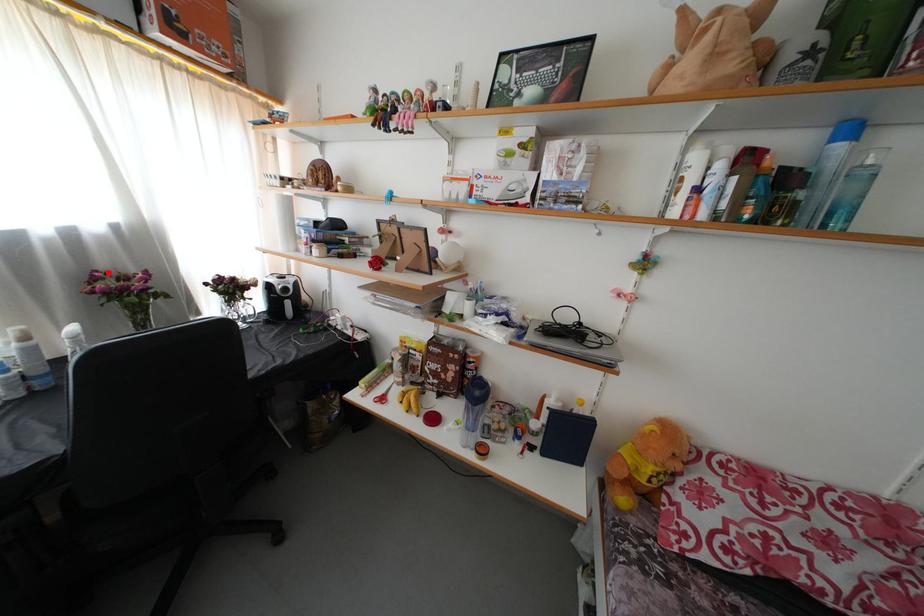
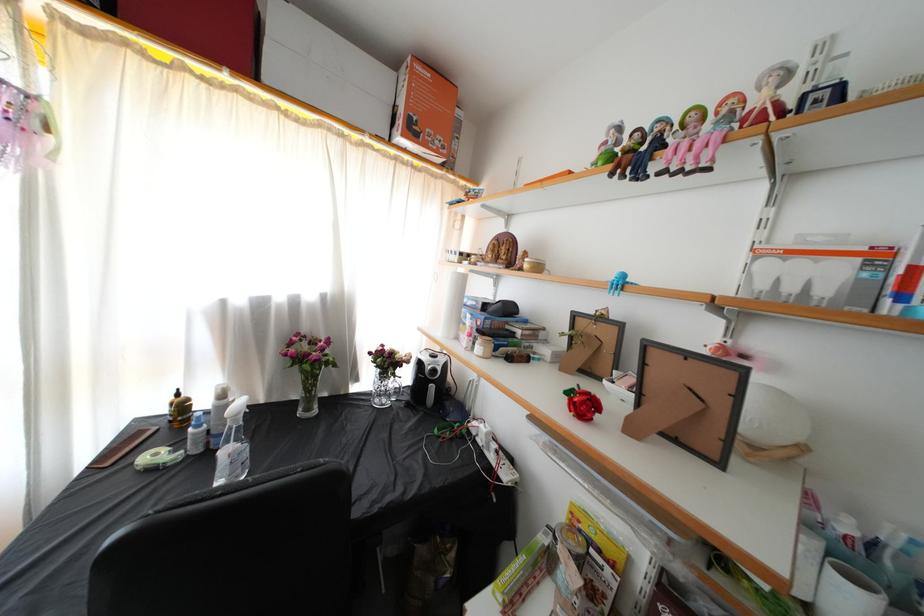
The point at the highlighted location is marked in the first image. Where is the corresponding point in the second image?

(310, 334)